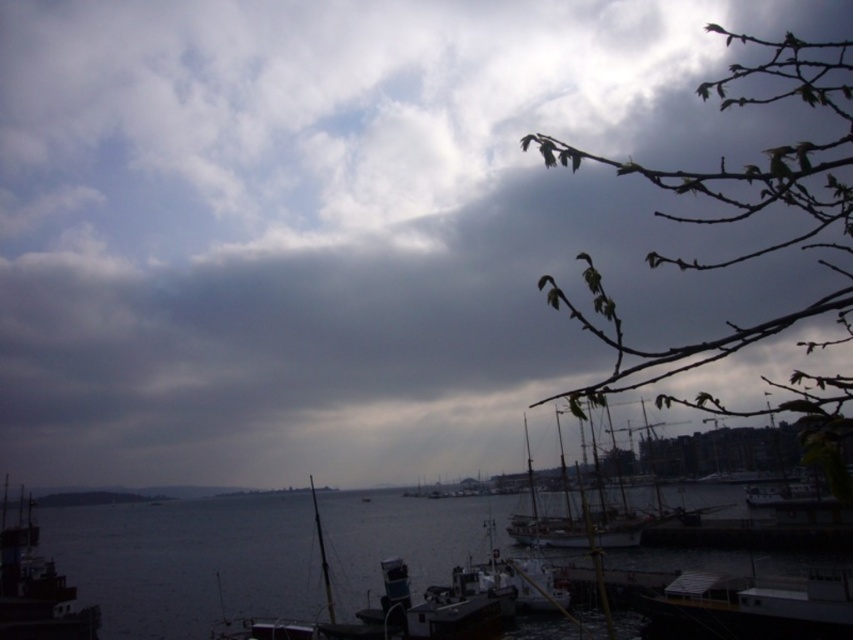
Question: Among these objects, which one is nearest to the camera?

Choices:
 (A) metallic gray boat at lower left
 (B) white wooden sailboat at center

Answer: (B)

Question: Which object is farther from the camera taking this photo?

Choices:
 (A) metallic gray boat at lower left
 (B) white wooden sailboat at center
 (C) dark water at lower center

Answer: (A)

Question: Can you confirm if dark water at lower center is positioned above white wooden sailboat at center?

Choices:
 (A) yes
 (B) no

Answer: (B)

Question: Does metallic gray boat at lower left have a smaller size compared to white wooden sailboat at center?

Choices:
 (A) no
 (B) yes

Answer: (B)

Question: Which object is positioned farthest from the metallic gray boat at lower left?

Choices:
 (A) dark water at lower center
 (B) white wooden sailboat at center

Answer: (A)

Question: Is metallic gray boat at lower left in front of white wooden sailboat at center?

Choices:
 (A) yes
 (B) no

Answer: (B)